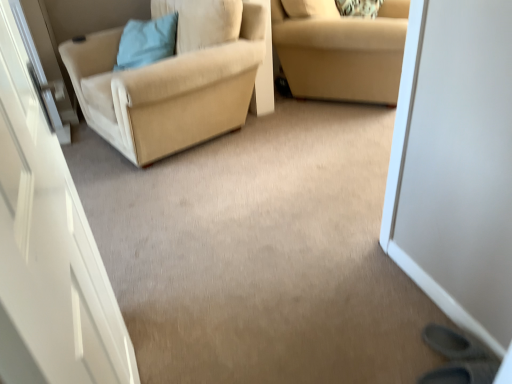
Question: Does beige fabric couch at upper right appear on the left side of beige fabric chair at left?

Choices:
 (A) yes
 (B) no

Answer: (B)

Question: Is beige fabric couch at upper right outside of beige fabric chair at left?

Choices:
 (A) no
 (B) yes

Answer: (B)

Question: Considering the relative positions of beige fabric couch at upper right and beige fabric chair at left in the image provided, is beige fabric couch at upper right behind beige fabric chair at left?

Choices:
 (A) no
 (B) yes

Answer: (B)

Question: Considering the relative sizes of beige fabric couch at upper right and beige fabric chair at left in the image provided, is beige fabric couch at upper right wider than beige fabric chair at left?

Choices:
 (A) yes
 (B) no

Answer: (B)

Question: From the image's perspective, is beige fabric couch at upper right on top of beige fabric chair at left?

Choices:
 (A) no
 (B) yes

Answer: (B)

Question: Is point (206, 97) positioned closer to the camera than point (153, 23)?

Choices:
 (A) closer
 (B) farther

Answer: (A)

Question: From a real-world perspective, relative to light blue fabric pillow at upper left, is beige fabric chair at left vertically above or below?

Choices:
 (A) below
 (B) above

Answer: (A)

Question: Would you say beige fabric chair at left is inside or outside light blue fabric pillow at upper left?

Choices:
 (A) inside
 (B) outside

Answer: (B)

Question: Would you say beige fabric chair at left is to the left or to the right of light blue fabric pillow at upper left in the picture?

Choices:
 (A) left
 (B) right

Answer: (B)

Question: In the image, is beige fabric couch at upper right positioned in front of or behind beige fabric chair at left?

Choices:
 (A) behind
 (B) front

Answer: (A)

Question: From a real-world perspective, is beige fabric couch at upper right physically located above or below beige fabric chair at left?

Choices:
 (A) above
 (B) below

Answer: (B)

Question: Considering the positions of point (375, 18) and point (248, 36), is point (375, 18) closer or farther from the camera than point (248, 36)?

Choices:
 (A) farther
 (B) closer

Answer: (A)

Question: Is beige fabric couch at upper right inside or outside of beige fabric chair at left?

Choices:
 (A) inside
 (B) outside

Answer: (B)

Question: Is light blue fabric pillow at upper left inside the boundaries of beige fabric couch at upper right, or outside?

Choices:
 (A) inside
 (B) outside

Answer: (B)

Question: Relative to beige fabric couch at upper right, is light blue fabric pillow at upper left in front or behind?

Choices:
 (A) behind
 (B) front

Answer: (A)